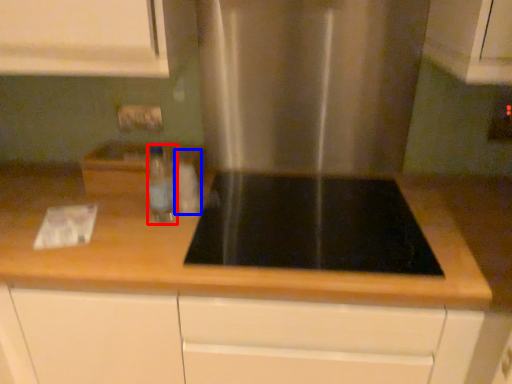
Question: Which point is closer to the camera, bottle (highlighted by a red box) or bottle (highlighted by a blue box)?

Choices:
 (A) bottle
 (B) bottle

Answer: (A)